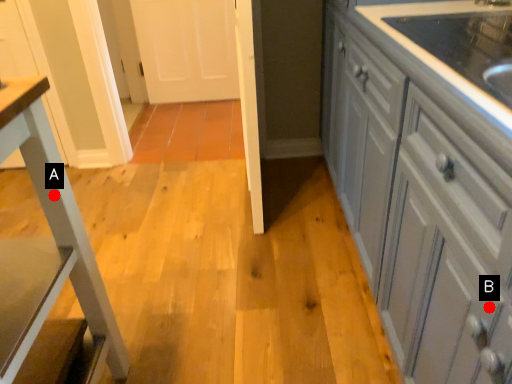
Question: Two points are circled on the image, labeled by A and B beside each circle. Which of the following is the closest to the observer?

Choices:
 (A) A is closer
 (B) B is closer

Answer: (B)